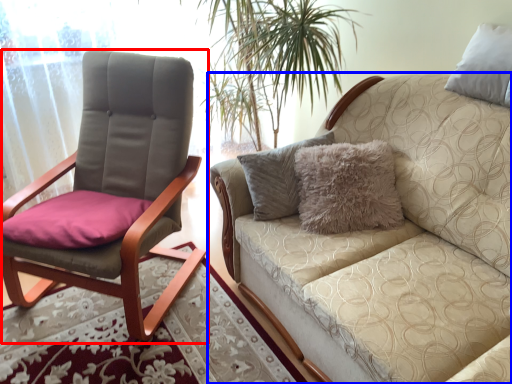
Question: Which point is further to the camera, chair (highlighted by a red box) or studio couch (highlighted by a blue box)?

Choices:
 (A) chair
 (B) studio couch

Answer: (A)